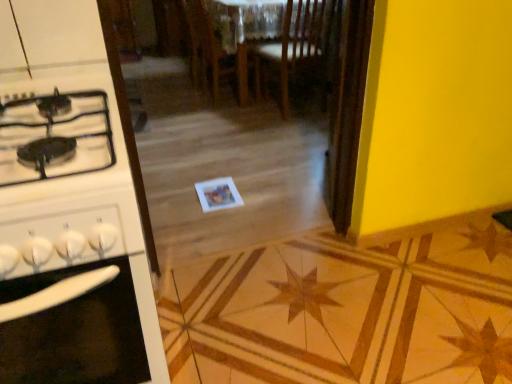
Question: Is wooden chair at center, which is the second chair from left to right, behind wooden chair at center, which is counted as the 1th chair, starting from the left?

Choices:
 (A) yes
 (B) no

Answer: (B)

Question: Does wooden chair at center, which is the 1th chair in right-to-left order, have a lesser height compared to wooden chair at center, acting as the second chair starting from the right?

Choices:
 (A) no
 (B) yes

Answer: (A)

Question: From the image's perspective, is wooden chair at center, which is the 1th chair in right-to-left order, on top of wooden chair at center, which is counted as the 1th chair, starting from the left?

Choices:
 (A) yes
 (B) no

Answer: (B)

Question: Is wooden chair at center, which is the 1th chair in right-to-left order, outside wooden chair at center, acting as the second chair starting from the right?

Choices:
 (A) yes
 (B) no

Answer: (A)

Question: Could you tell me if wooden chair at center, which is the 1th chair in right-to-left order, is facing wooden chair at center, which is counted as the 1th chair, starting from the left?

Choices:
 (A) yes
 (B) no

Answer: (B)

Question: In terms of width, does wooden chair at center, which is the second chair from left to right, look wider or thinner when compared to wooden screen door at center?

Choices:
 (A) thin
 (B) wide

Answer: (B)

Question: Is wooden chair at center, which is the 1th chair in right-to-left order, bigger or smaller than wooden screen door at center?

Choices:
 (A) big
 (B) small

Answer: (A)

Question: Would you say wooden chair at center, which is the 1th chair in right-to-left order, is to the left or to the right of wooden screen door at center in the picture?

Choices:
 (A) left
 (B) right

Answer: (A)

Question: Would you say wooden chair at center, which is the second chair from left to right, is inside or outside wooden screen door at center?

Choices:
 (A) outside
 (B) inside

Answer: (A)

Question: Based on their sizes in the image, would you say wooden chair at center, acting as the second chair starting from the right, is bigger or smaller than white glossy stove at left?

Choices:
 (A) big
 (B) small

Answer: (B)

Question: Considering their positions, is wooden chair at center, which is counted as the 1th chair, starting from the left, located in front of or behind white glossy stove at left?

Choices:
 (A) behind
 (B) front

Answer: (A)

Question: From the image's perspective, is wooden chair at center, acting as the second chair starting from the right, positioned above or below white glossy stove at left?

Choices:
 (A) above
 (B) below

Answer: (A)

Question: Considering the positions of wooden chair at center, acting as the second chair starting from the right, and white glossy stove at left in the image, is wooden chair at center, acting as the second chair starting from the right, wider or thinner than white glossy stove at left?

Choices:
 (A) thin
 (B) wide

Answer: (A)

Question: Looking at their shapes, would you say wooden screen door at center is wider or thinner than white glossy stove at left?

Choices:
 (A) wide
 (B) thin

Answer: (B)

Question: Is wooden screen door at center situated inside white glossy stove at left or outside?

Choices:
 (A) outside
 (B) inside

Answer: (A)